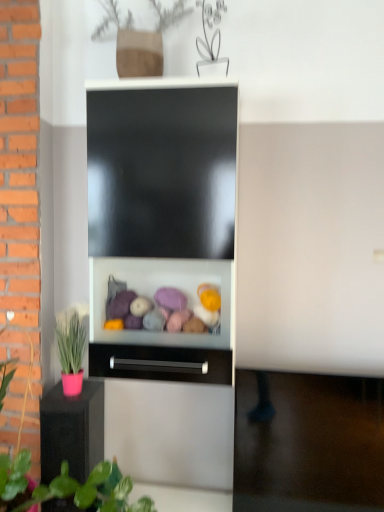
Describe the element at coordinates (161, 362) in the screenshot. I see `black matte drawer at center` at that location.

Where is `black matte drawer at center`? The width and height of the screenshot is (384, 512). black matte drawer at center is located at coordinates (161, 362).

This screenshot has width=384, height=512. Describe the element at coordinates (72, 431) in the screenshot. I see `pink matte pot at lower left` at that location.

What is the approximate width of pink matte pot at lower left?

The width of pink matte pot at lower left is 12.63 inches.

Locate an element on the screen. The image size is (384, 512). black matte drawer at center is located at coordinates (x=161, y=362).

Is black matte drawer at center bigger or smaller than pink matte pot at lower left?

Considering their sizes, black matte drawer at center takes up less space than pink matte pot at lower left.

Would you consider black matte drawer at center to be distant from pink matte pot at lower left?

Actually, black matte drawer at center and pink matte pot at lower left are a little close together.

Can you confirm if black matte drawer at center is positioned to the right of pink matte pot at lower left?

Correct, you'll find black matte drawer at center to the right of pink matte pot at lower left.

Which object is positioned more to the left, black matte drawer at center or pink matte pot at left?

From the viewer's perspective, pink matte pot at left appears more on the left side.

Is black matte drawer at center further to camera compared to pink matte pot at left?

Yes, the depth of black matte drawer at center is greater than that of pink matte pot at left.

Identify the location of drawer above the pink matte pot at left (from a real-world perspective). Image resolution: width=384 pixels, height=512 pixels. (161, 362).

Is pink matte pot at lower left looking in the opposite direction of pink matte pot at left?

Yes, pink matte pot at left is at the back of pink matte pot at lower left.

Who is bigger, pink matte pot at lower left or pink matte pot at left?

With larger size is pink matte pot at left.

From a real-world perspective, is pink matte pot at lower left located beneath pink matte pot at left?

Correct, in the physical world, pink matte pot at lower left is lower than pink matte pot at left.

Choose the correct answer: Is pink matte pot at lower left inside black matte drawer at center or outside it?

pink matte pot at lower left exists outside the volume of black matte drawer at center.

From the image's perspective, which one is positioned lower, pink matte pot at lower left or black matte drawer at center?

pink matte pot at lower left appears lower in the image.

Considering the relative positions of pink matte pot at lower left and black matte drawer at center in the image provided, is pink matte pot at lower left behind black matte drawer at center?

Yes, it is behind black matte drawer at center.

The image size is (384, 512). Find the location of `plant above the pink matte pot at lower left (from a real-world perspective)`. plant above the pink matte pot at lower left (from a real-world perspective) is located at coordinates (89, 492).

Are pink matte pot at left and pink matte pot at lower left making contact?

No, pink matte pot at left is not touching pink matte pot at lower left.

Which point is more forward, (52, 485) or (53, 510)?

The point (52, 485) is closer.

Consider the image. From a real-world perspective, which object stands above the other?

pink matte pot at left, from a real-world perspective.

Can you confirm if pink matte pot at left is bigger than black matte drawer at center?

Correct, pink matte pot at left is larger in size than black matte drawer at center.

Can you confirm if pink matte pot at left is shorter than black matte drawer at center?

In fact, pink matte pot at left may be taller than black matte drawer at center.

Is pink matte pot at left oriented away from black matte drawer at center?

Correct, pink matte pot at left is looking away from black matte drawer at center.

I want to click on drawer that is above the pink matte pot at left (from the image's perspective), so click(x=161, y=362).

In the image, there is a pink matte pot at lower left. Where is `drawer above it (from the image's perspective)`? The width and height of the screenshot is (384, 512). drawer above it (from the image's perspective) is located at coordinates (161, 362).

Identify the location of drawer behind the pink matte pot at left. Image resolution: width=384 pixels, height=512 pixels. [161, 362].

Considering their positions, is black matte drawer at center positioned closer to pink matte pot at left than pink matte pot at lower left?

Among the two, pink matte pot at lower left is located nearer to pink matte pot at left.

From the image, which object appears to be nearer to pink matte pot at lower left, pink matte pot at left or black matte drawer at center?

black matte drawer at center lies closer to pink matte pot at lower left than the other object.

Looking at the image, which one is located further to black matte drawer at center, pink matte pot at left or pink matte pot at lower left?

Among the two, pink matte pot at left is located further to black matte drawer at center.

Looking at the image, which one is located further to pink matte pot at left, pink matte pot at lower left or black matte drawer at center?

Among the two, black matte drawer at center is located further to pink matte pot at left.

Considering their positions, is pink matte pot at lower left positioned further to black matte drawer at center than pink matte pot at left?

pink matte pot at left is further to black matte drawer at center.

Based on their spatial positions, is black matte drawer at center or pink matte pot at left closer to pink matte pot at lower left?

black matte drawer at center is closer to pink matte pot at lower left.

I want to click on drawer between pink matte pot at left and pink matte pot at lower left from front to back, so click(x=161, y=362).